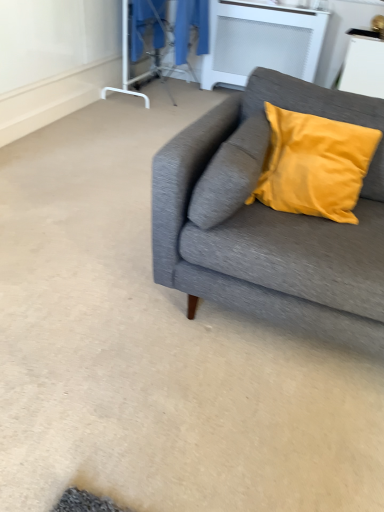
Image resolution: width=384 pixels, height=512 pixels. I want to click on vacant space in front of textured gray couch at right, so click(216, 426).